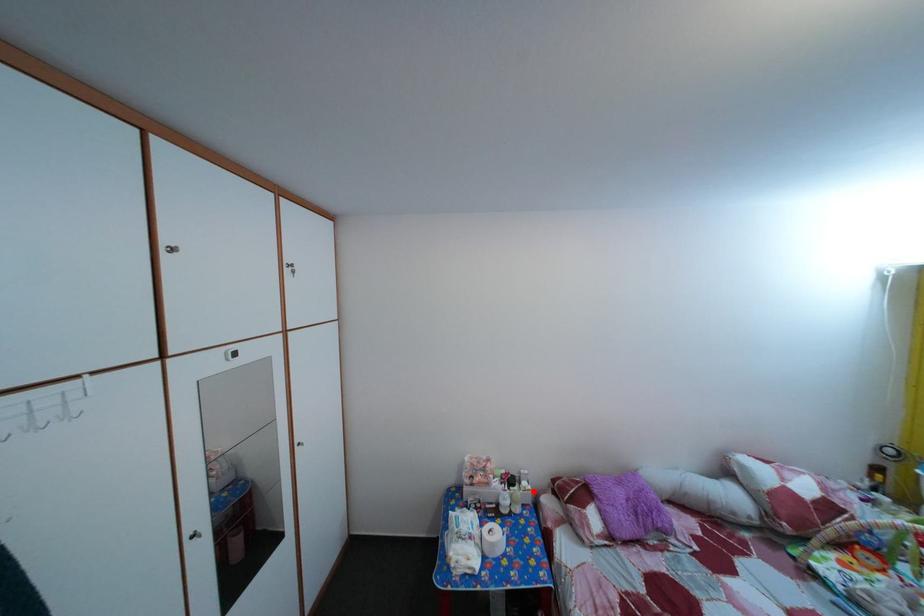
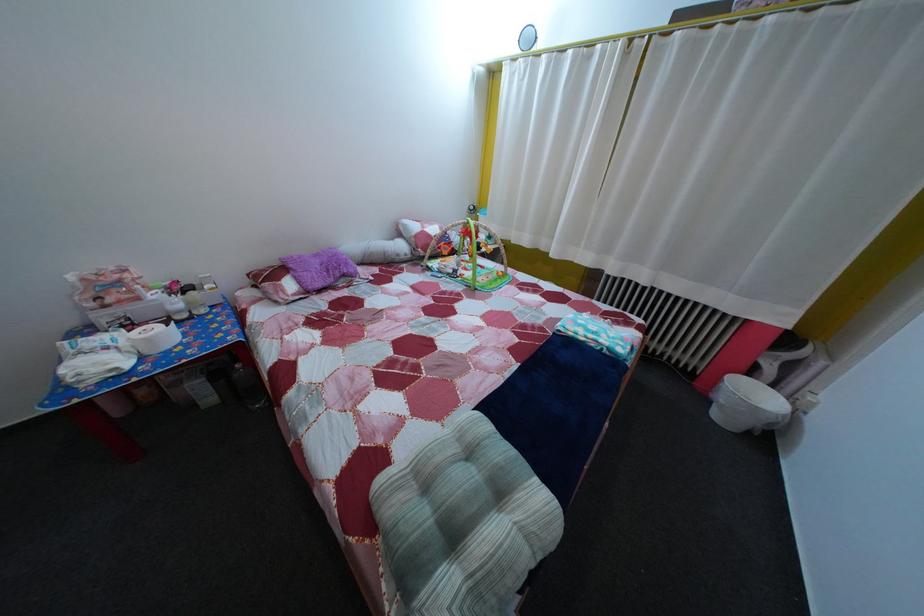
Question: I am providing you with two images of the same scene from different viewpoints. Image1 has a red point marked. In image2, the corresponding 3D location appears at what relative position? Reply with the corresponding letter.

Choices:
 (A) Closer
 (B) Farther

Answer: (A)